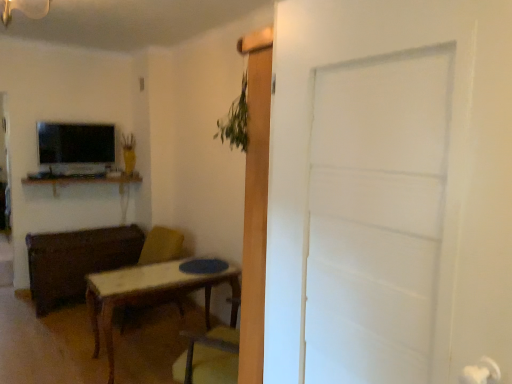
Question: Would you say matte black tv at upper left is inside or outside wooden desk at upper left?

Choices:
 (A) inside
 (B) outside

Answer: (B)

Question: From a real-world perspective, is matte black tv at upper left physically located above or below wooden desk at upper left?

Choices:
 (A) below
 (B) above

Answer: (B)

Question: Estimate the real-world distances between objects in this image. Which object is closer to the wooden desk at upper left?

Choices:
 (A) white matte door at center
 (B) wooden swivel chair at center
 (C) matte black tv at upper left
 (D) matte wood chest at left

Answer: (C)

Question: Estimate the real-world distances between objects in this image. Which object is farther from the wooden swivel chair at center?

Choices:
 (A) matte black tv at upper left
 (B) matte wood chest at left
 (C) white matte door at center
 (D) wooden desk at upper left

Answer: (C)